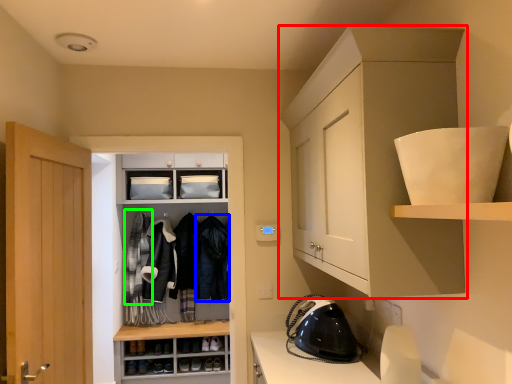
Question: Estimate the real-world distances between objects in this image. Which object is closer to cabinetry (highlighted by a red box), clothing (highlighted by a blue box) or clothing (highlighted by a green box)?

Choices:
 (A) clothing
 (B) clothing

Answer: (A)